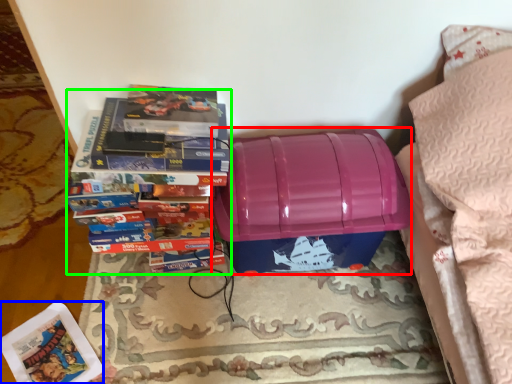
Question: Estimate the real-world distances between objects in this image. Which object is closer to storage box (highlighted by a red box), paperback book (highlighted by a blue box) or book (highlighted by a green box)?

Choices:
 (A) paperback book
 (B) book

Answer: (B)